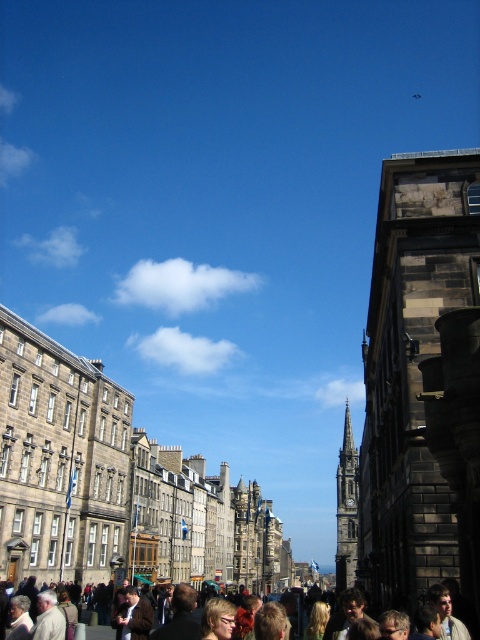
Question: Which point is farther to the camera?

Choices:
 (A) dark gray stone spire at center
 (B) dark stone tower at right

Answer: (A)

Question: Which of the following is the closest to the observer?

Choices:
 (A) dark gray stone spire at center
 (B) brown leather jacket at lower center
 (C) dark stone tower at right

Answer: (B)

Question: Can you confirm if dark gray stone spire at center is positioned to the right of brown leather jacket at lower center?

Choices:
 (A) yes
 (B) no

Answer: (A)

Question: Among these points, which one is farthest from the camera?

Choices:
 (A) (339, 576)
 (B) (3, 608)
 (C) (430, 458)

Answer: (A)

Question: Does dark stone tower at right appear under dark gray stone spire at center?

Choices:
 (A) yes
 (B) no

Answer: (B)

Question: Is dark gray stone spire at center wider than brown leather jacket at lower center?

Choices:
 (A) yes
 (B) no

Answer: (B)